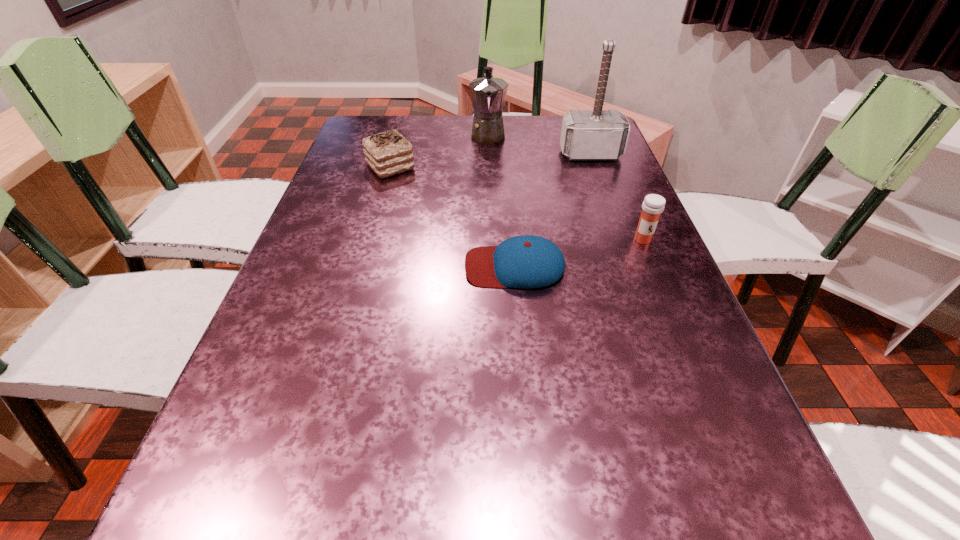
Find the location of `the tallest object`. the tallest object is located at coordinates (597, 134).

You are a GUI agent. You are given a task and a screenshot of the screen. Output one action in this format:
    pyautogui.click(x=<x>, y=<y>)
    Task: Click on the second tallest object
    This screenshot has width=960, height=540.
    Given the screenshot: What is the action you would take?
    pyautogui.click(x=488, y=94)

Locate an element on the screen. medicine is located at coordinates (653, 205).

Image resolution: width=960 pixels, height=540 pixels. I want to click on the leftmost object, so click(x=388, y=153).

Locate an element on the screen. baseball cap is located at coordinates pyautogui.click(x=527, y=261).

Where is `blank area located for striking with the head of the tallest object`? The image size is (960, 540). blank area located for striking with the head of the tallest object is located at coordinates (618, 232).

Find the location of a particular element. The width and height of the screenshot is (960, 540). free space located 0.150m on the pouring side of the fourth shortest object is located at coordinates (489, 174).

This screenshot has height=540, width=960. I want to click on vacant space located on the label side of the medicine, so click(x=678, y=323).

Where is `vacant space located on the back of the leftmost object`? This screenshot has width=960, height=540. vacant space located on the back of the leftmost object is located at coordinates (403, 122).

This screenshot has width=960, height=540. What are the coordinates of `blank space located with the bill of the shortest object facing forward` in the screenshot? It's located at (337, 266).